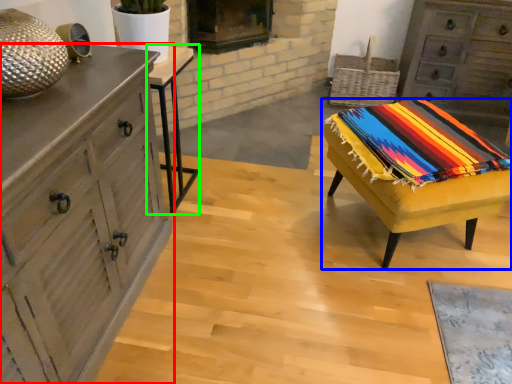
Question: Which object is positioned closest to chest of drawers (highlighted by a red box)? Select from table (highlighted by a blue box) and table (highlighted by a green box).

Choices:
 (A) table
 (B) table

Answer: (B)